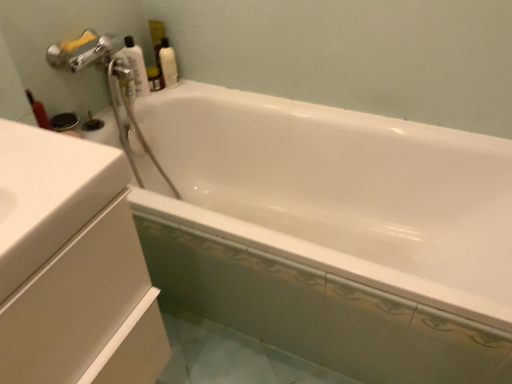
The width and height of the screenshot is (512, 384). I want to click on vacant area that is in front of white glossy bottle at upper left, placed as the 2th cleaning product when sorted from right to left, so click(123, 105).